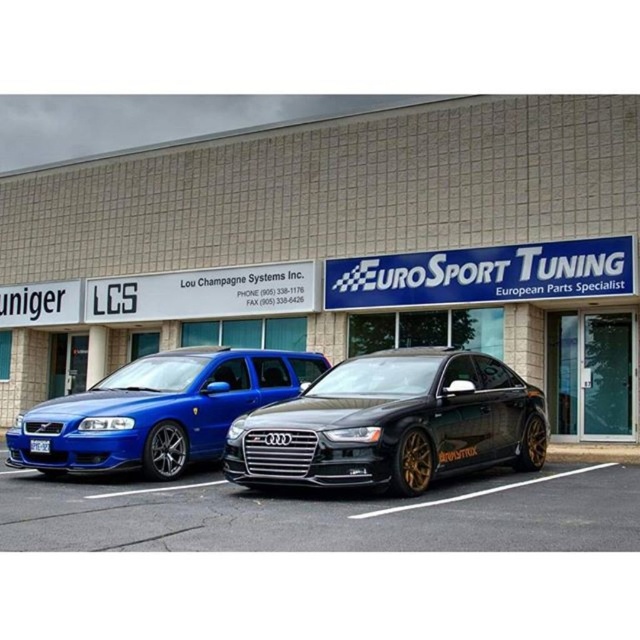
Question: Does black matte audi sedan at center appear over white plastic license plate at center?

Choices:
 (A) no
 (B) yes

Answer: (B)

Question: Is metallic blue sedan at center further to camera compared to white plastic license plate at center?

Choices:
 (A) no
 (B) yes

Answer: (B)

Question: Among these objects, which one is farthest from the camera?

Choices:
 (A) metallic blue sedan at center
 (B) white plastic license plate at center
 (C) black matte audi sedan at center
 (D) metallic blue car at center

Answer: (D)

Question: Which object is farther from the camera taking this photo?

Choices:
 (A) metallic blue car at center
 (B) black matte audi sedan at center

Answer: (A)

Question: Which object is the closest to the white plastic license plate at center?

Choices:
 (A) metallic blue car at center
 (B) metallic blue sedan at center
 (C) black matte audi sedan at center

Answer: (B)

Question: Is metallic blue car at center to the right of white plastic license plate at center from the viewer's perspective?

Choices:
 (A) no
 (B) yes

Answer: (B)